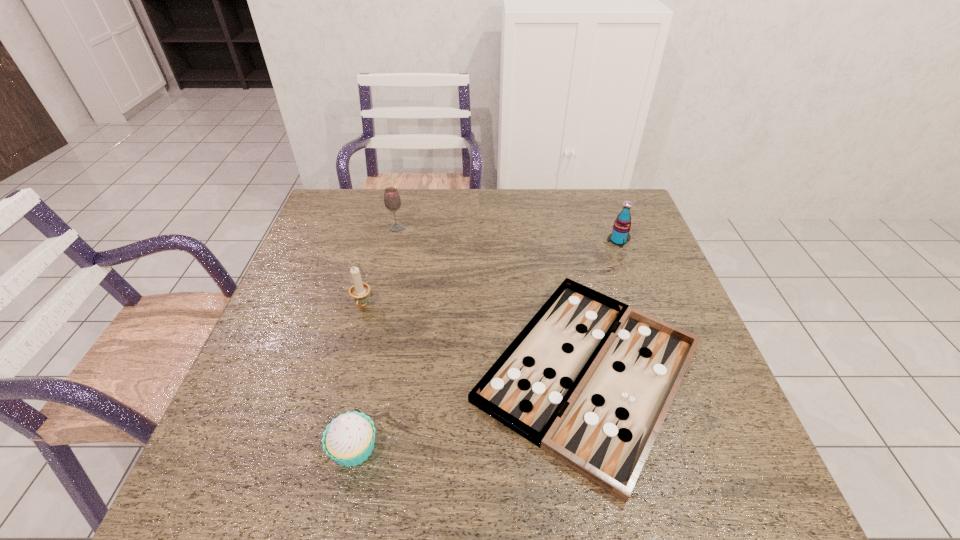
The width and height of the screenshot is (960, 540). I want to click on object present at the far edge, so click(x=392, y=201).

Locate an element on the screen. This screenshot has width=960, height=540. cupcake situated at the near edge is located at coordinates (349, 439).

Locate an element on the screen. The image size is (960, 540). gameboard present at the near edge is located at coordinates (589, 380).

Where is `soda that is at the right edge`? This screenshot has height=540, width=960. soda that is at the right edge is located at coordinates (620, 235).

Identify the location of gameboard located in the right edge section of the desktop. This screenshot has height=540, width=960. (589, 380).

At what (x,y) coordinates should I click in order to perform the action: click on object present at the near right corner. Please return your answer as a coordinate pair (x, y). Looking at the image, I should click on (589, 380).

Identify the location of vacant space at the far edge. This screenshot has width=960, height=540. (569, 207).

In the image, there is a desktop. Where is `blank space at the near edge`? blank space at the near edge is located at coordinates (458, 474).

The width and height of the screenshot is (960, 540). What are the coordinates of `free space at the left edge of the desktop` in the screenshot? It's located at (323, 242).

Find the location of a particular element. This screenshot has width=960, height=540. free space at the right edge of the desktop is located at coordinates (621, 282).